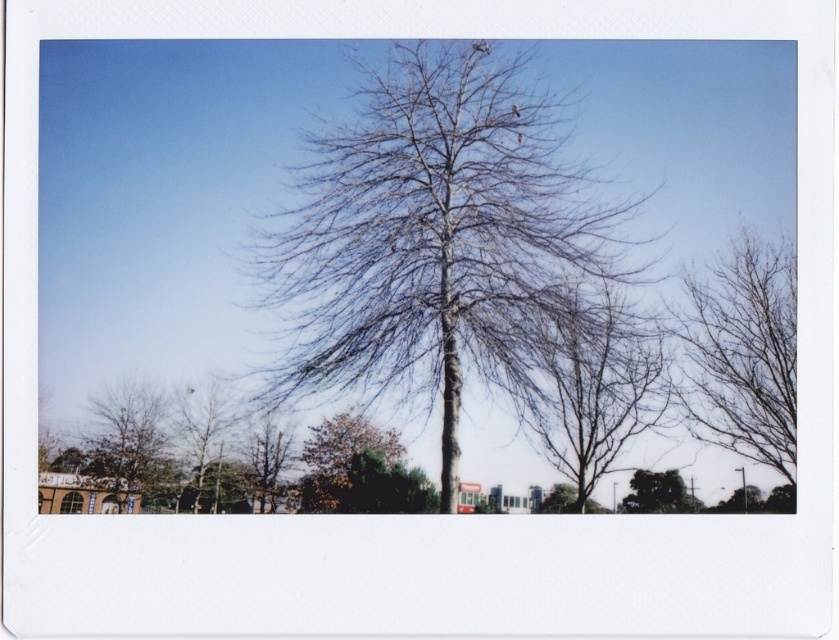
Question: Which object is positioned farthest from the brown rough bark tree at lower left?

Choices:
 (A) bare wood tree at center
 (B) bare branches at right

Answer: (B)

Question: Does bare wood tree at center have a smaller size compared to bare branches at lower left?

Choices:
 (A) no
 (B) yes

Answer: (A)

Question: Is bare wood tree at center positioned before bare branches at lower left?

Choices:
 (A) no
 (B) yes

Answer: (B)

Question: Is bare branches at right above brown matte tree at lower left?

Choices:
 (A) no
 (B) yes

Answer: (B)

Question: Which point is farther from the camera taking this photo?

Choices:
 (A) (743, 323)
 (B) (289, 424)

Answer: (A)

Question: Which point is farther to the camera?

Choices:
 (A) (545, 410)
 (B) (118, 420)
 (C) (206, 472)
 (D) (770, 275)

Answer: (D)